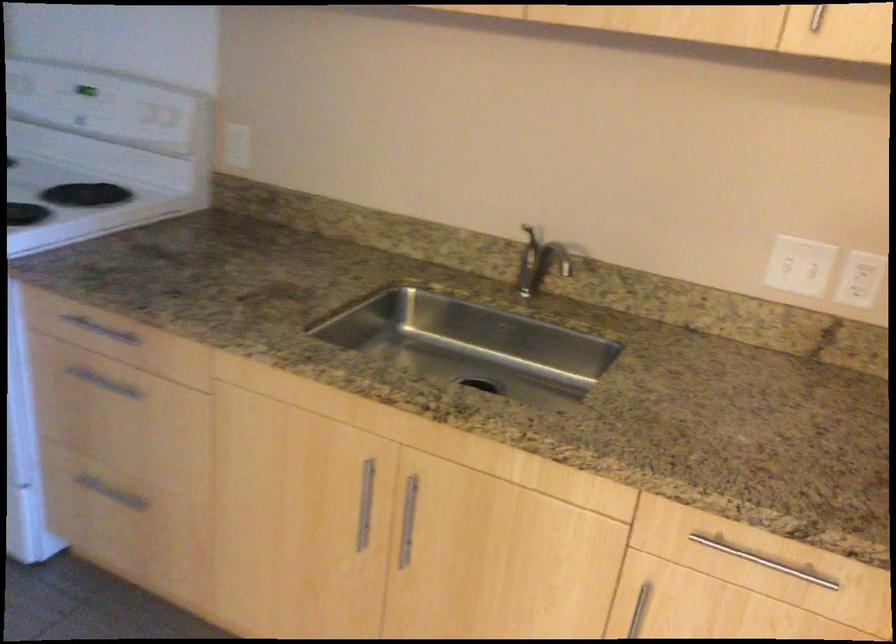
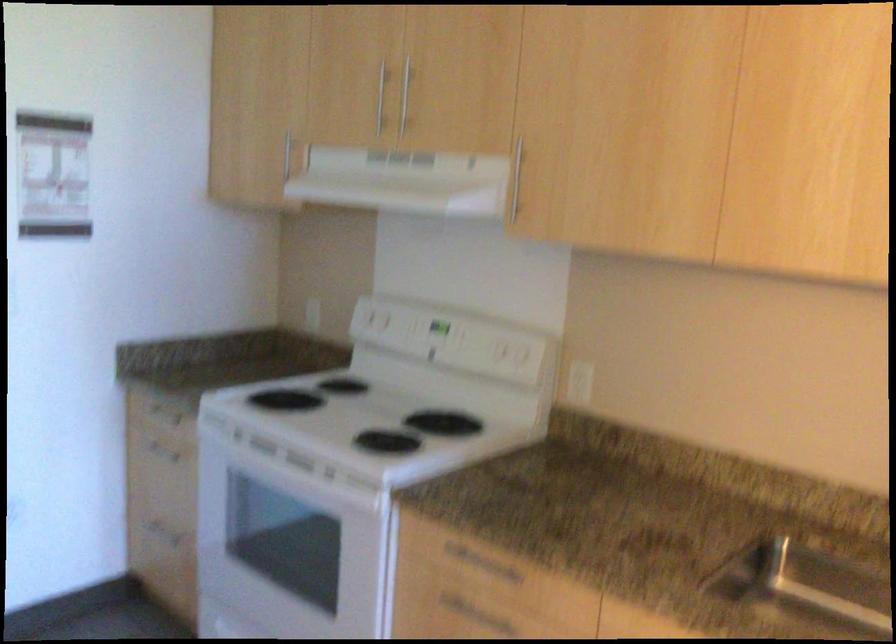
Question: How did the camera likely rotate?

Choices:
 (A) Left
 (B) Right
 (C) Up
 (D) Down

Answer: (C)